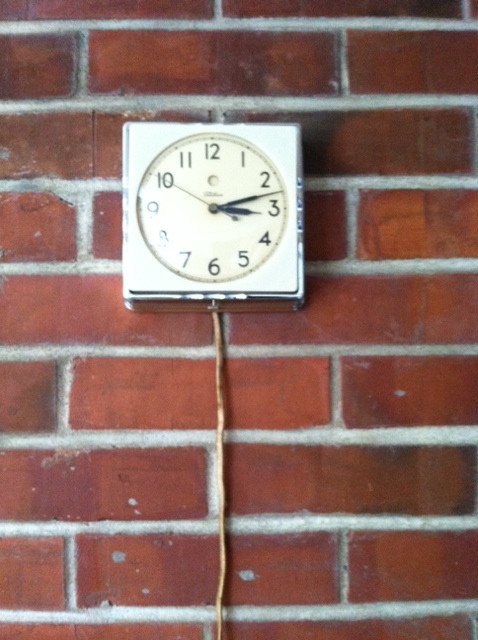
What are the coordinates of `white square around clock` in the screenshot? It's located at (147, 141), (284, 141), (274, 272), (152, 274).